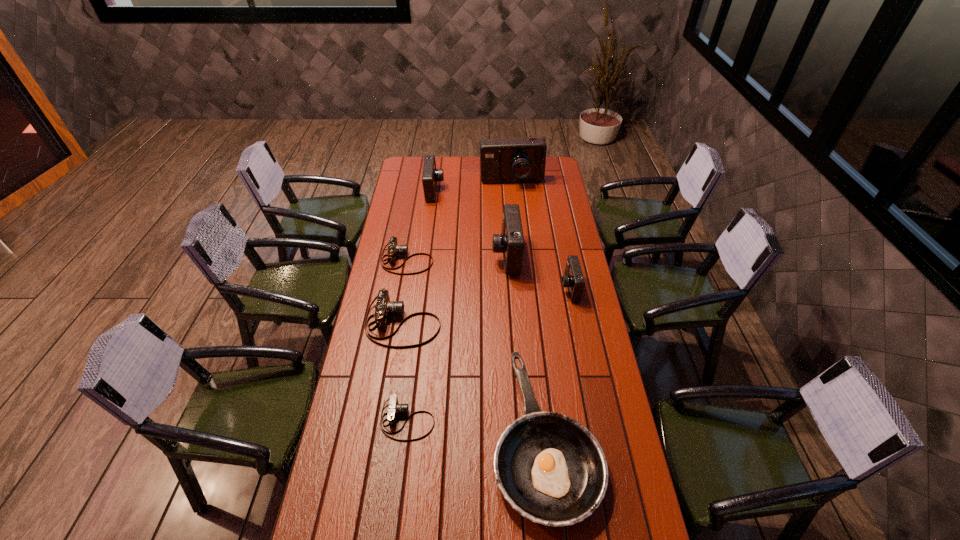
In order to click on the biggest blue camera in this screenshot , I will do (x=522, y=159).

Locate an element on the screen. the tallest object is located at coordinates (522, 159).

The width and height of the screenshot is (960, 540). I want to click on the second biggest blue camera, so (510, 242).

Find the location of a particular element. The width and height of the screenshot is (960, 540). the sixth shortest camera is located at coordinates (510, 242).

Locate an element on the screen. The image size is (960, 540). the second smallest blue camera is located at coordinates (430, 176).

Locate an element on the screen. This screenshot has height=540, width=960. the leftmost blue camera is located at coordinates (430, 176).

At what (x,y) coordinates should I click in order to perform the action: click on the fourth shortest camera. Please return your answer as a coordinate pair (x, y). Looking at the image, I should click on (573, 279).

Where is `the smallest blue camera`? The image size is (960, 540). the smallest blue camera is located at coordinates (573, 279).

The image size is (960, 540). I want to click on the second nearest brown camera, so click(384, 308).

This screenshot has width=960, height=540. I want to click on the biggest brown camera, so click(384, 308).